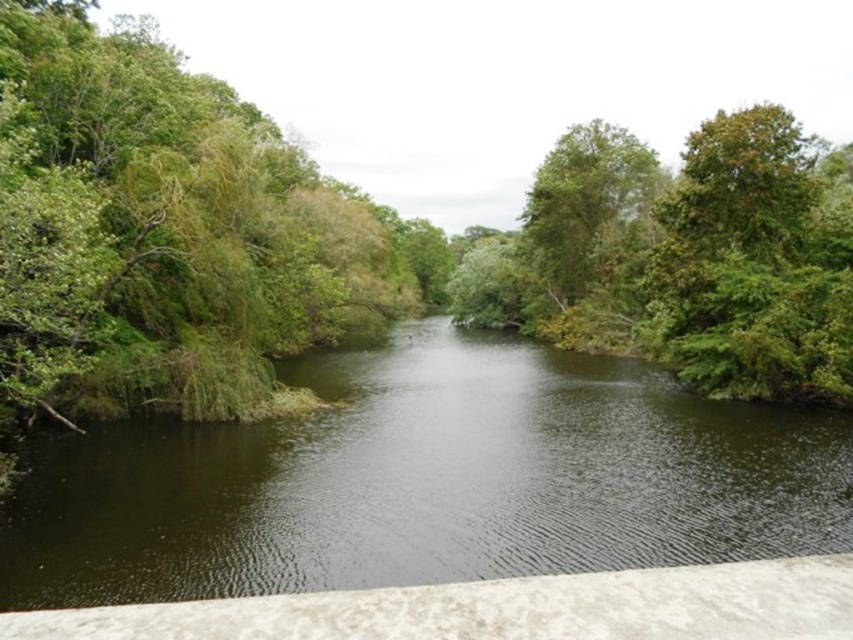
You are a kayaker planning to paddle down the river shown in the image. You notice the dark green water at center and the green leafy tree at upper right. Which path should you choose to ensure you have enough space to maneuver your kayak comfortably?

The dark green water at center is wider than the green leafy tree at upper right, so choosing the path through the dark green water at center would provide more space for maneuvering the kayak comfortably.

You are a kayaker preparing to paddle down the river shown in the image. You see the dark green water at center and the green leafy tree at upper right. Which object is located directly above the other?

The green leafy tree at upper right is positioned above the dark green water at center.

You are standing at the center of the image and want to locate the dark green water at center. According to the coordinates provided, in which direction should you look to find it?

The dark green water at center is located at coordinates point (x=426, y=481). Since you are at the center, looking towards the right direction will help you find it because the x coordinate 0.752 is greater than 0.5, indicating it is to the right.